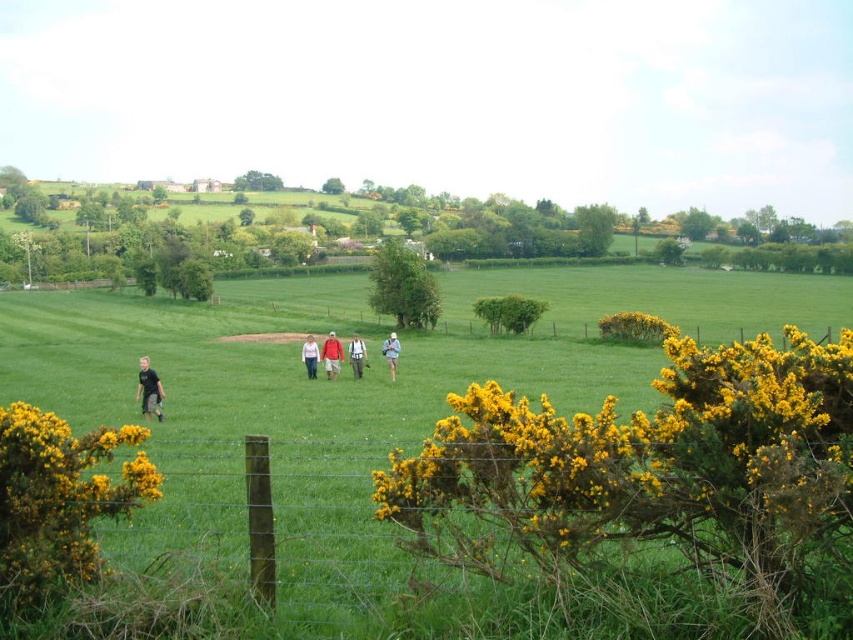
Is point (149, 522) closer to viewer compared to point (355, 353)?

Yes, it is in front of point (355, 353).

Is wire mesh fence at lower center shorter than white cotton shirt at center?

No, wire mesh fence at lower center is not shorter than white cotton shirt at center.

Who is more forward, [671,568] or [355,356]?

Point [671,568] is in front.

Find the location of `wire mesh fence at lower center`. wire mesh fence at lower center is located at coordinates (428, 566).

Is white cotton shirt at center to the left of blue fabric backpack at center from the viewer's perspective?

Yes, white cotton shirt at center is to the left of blue fabric backpack at center.

Identify the location of white cotton shirt at center. (357, 355).

Locate an element on the screen. This screenshot has height=640, width=853. white cotton shirt at center is located at coordinates (357, 355).

Who is taller, green grassy field at center or light brown hair at lower left?

green grassy field at center

Which is in front, point (397, 556) or point (148, 412)?

Point (397, 556) is in front.

Locate an element on the screen. green grassy field at center is located at coordinates (349, 397).